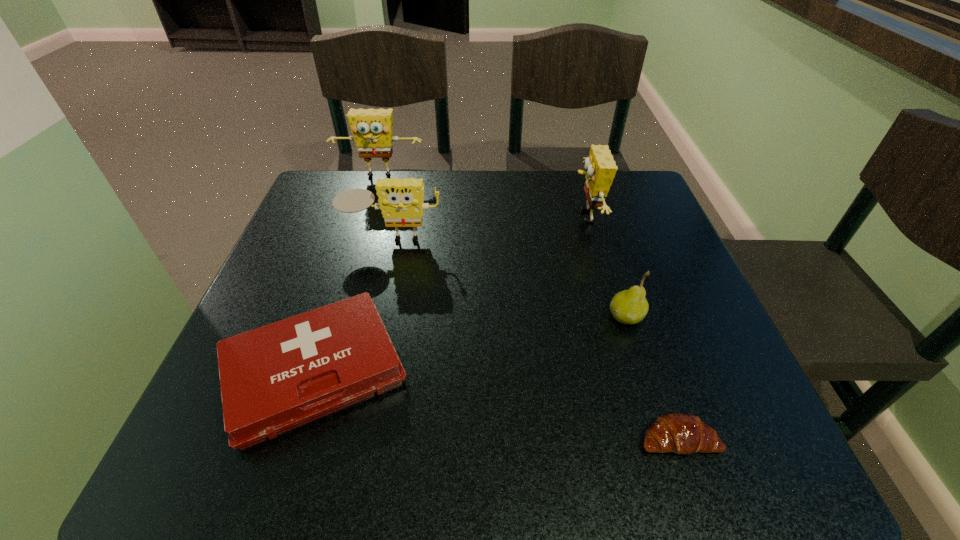
You are a GUI agent. You are given a task and a screenshot of the screen. Output one action in this format:
    pyautogui.click(x=<x>, y=<y>)
    Task: Click on the object situated at the far right corner
    The image size is (960, 540).
    Given the screenshot: What is the action you would take?
    pyautogui.click(x=600, y=166)

In order to click on object present at the near right corner in this screenshot , I will do `click(680, 433)`.

I want to click on vacant space at the far edge, so click(x=431, y=205).

Locate an element on the screen. vacant space at the near edge is located at coordinates (321, 432).

In the image, there is a desktop. At what (x,y) coordinates should I click in order to perform the action: click on vacant space at the left edge. Please return your answer as a coordinate pair (x, y). This screenshot has height=540, width=960. Looking at the image, I should click on (310, 294).

The width and height of the screenshot is (960, 540). In the image, there is a desktop. In order to click on vacant region at the right edge in this screenshot , I will do [676, 289].

Find the location of a particular element. The width and height of the screenshot is (960, 540). free space that is in between the second shortest object and the farthest sponge is located at coordinates (347, 274).

The image size is (960, 540). In order to click on free area in between the rightmost sponge and the farthest object in this screenshot , I will do `click(482, 197)`.

Locate an element on the screen. This screenshot has width=960, height=540. vacant area that lies between the first-aid kit and the fourth tallest object is located at coordinates (470, 344).

Identify the location of empty location between the farthest sponge and the fourth tallest object. The width and height of the screenshot is (960, 540). (503, 247).